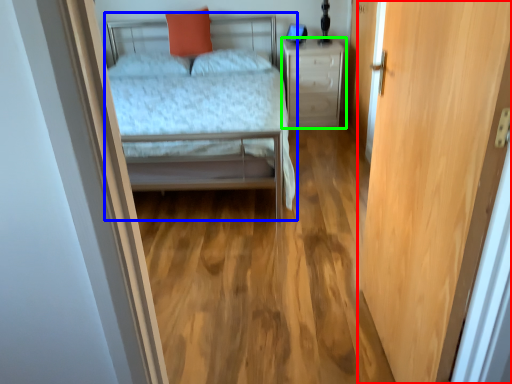
Question: Estimate the real-world distances between objects in this image. Which object is farther from door (highlighted by a red box), bed (highlighted by a blue box) or nightstand (highlighted by a green box)?

Choices:
 (A) bed
 (B) nightstand

Answer: (B)